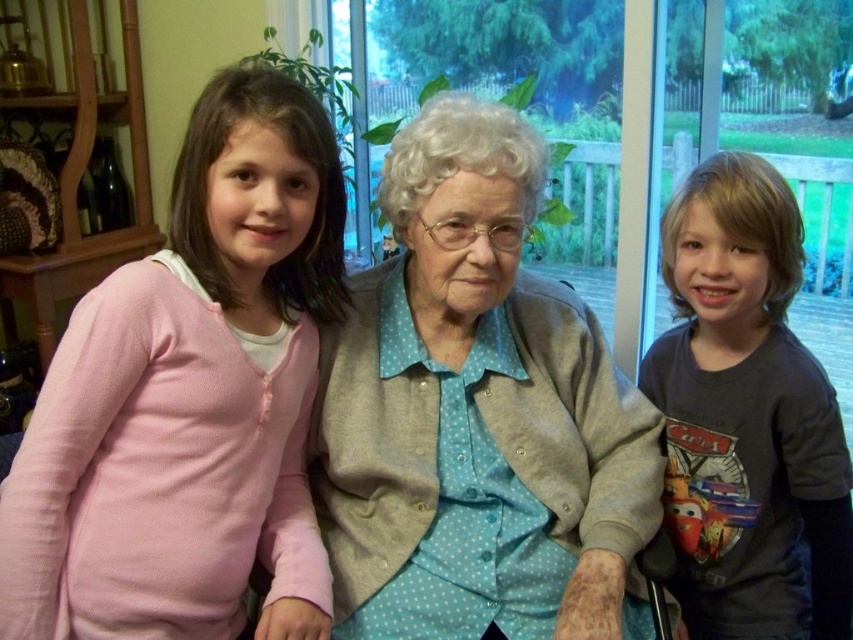
What are the coordinates of the light blue dotted fabric at center?

The coordinates of the light blue dotted fabric at center are at point (476,413).

Based on the scene description, can you determine the spatial relationship between the pink cotton sweater at left and the light blue dotted fabric at center?

The pink cotton sweater at left is positioned above the light blue dotted fabric at center.

You are a tailor who needs to determine which item requires more fabric for alterations between the pink cotton sweater at left and the light blue dotted fabric at center. Based on their sizes, which one would need more fabric?

The light blue dotted fabric at center requires more fabric for alterations since it has a larger size compared to the pink cotton sweater at left.